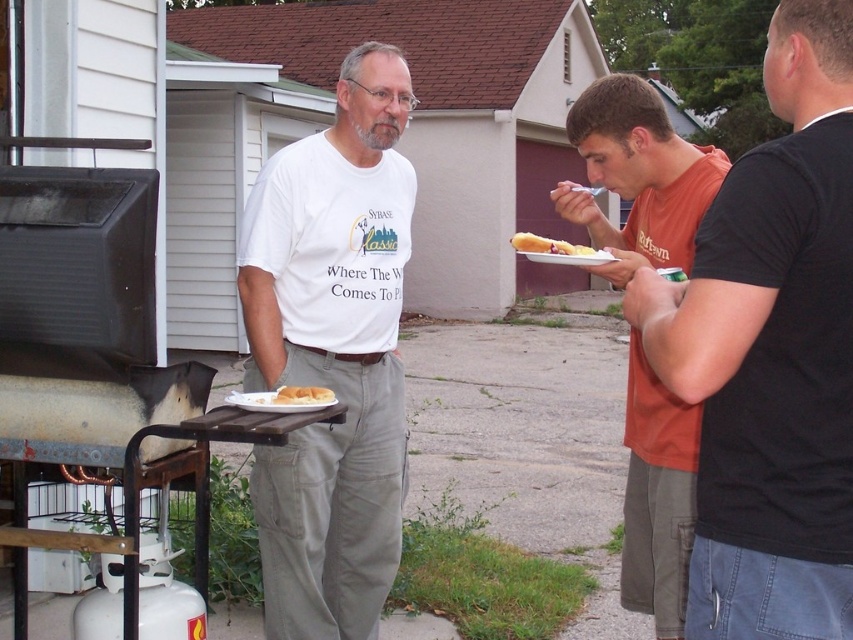
Is white matte t-shirt at center shorter than golden fried chicken at center?

In fact, white matte t-shirt at center may be taller than golden fried chicken at center.

Which is in front, point (300, 483) or point (288, 387)?

Point (288, 387)

Find the location of a particular element. white matte t-shirt at center is located at coordinates (332, 353).

You are a GUI agent. You are given a task and a screenshot of the screen. Output one action in this format:
    pyautogui.click(x=<x>, y=<y>)
    Task: Click on the white matte t-shirt at center
    The image size is (853, 640).
    Given the screenshot: What is the action you would take?
    pyautogui.click(x=332, y=353)

Which is in front, point (664, 506) or point (294, 390)?

Point (664, 506) is more forward.

Is orange t-shirt at center shorter than golden fried chicken at center?

In fact, orange t-shirt at center may be taller than golden fried chicken at center.

Is point (706, 168) less distant than point (283, 394)?

No, it is behind (283, 394).

The image size is (853, 640). I want to click on orange t-shirt at center, so click(637, 177).

Is orange t-shirt at center below white matte bread at center?

No, orange t-shirt at center is not below white matte bread at center.

What do you see at coordinates (637, 177) in the screenshot? I see `orange t-shirt at center` at bounding box center [637, 177].

The height and width of the screenshot is (640, 853). Find the location of `orange t-shirt at center`. orange t-shirt at center is located at coordinates [637, 177].

Find the location of a particular element. The height and width of the screenshot is (640, 853). orange t-shirt at center is located at coordinates (637, 177).